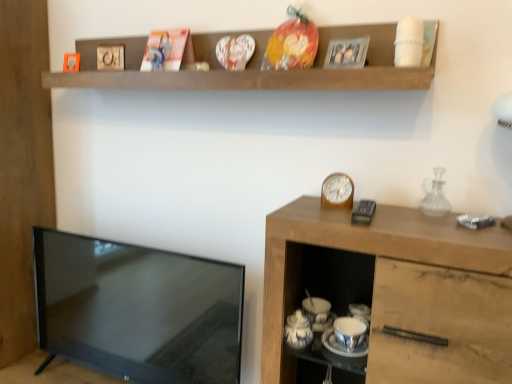
Question: Is matte cardboard picture frame at upper center, which appears as the second picture frame when viewed from the front, completely or partially outside of matte black tv at left?

Choices:
 (A) yes
 (B) no

Answer: (A)

Question: Does matte cardboard picture frame at upper center, the 2th picture frame when ordered from right to left, have a lesser width compared to matte black tv at left?

Choices:
 (A) yes
 (B) no

Answer: (A)

Question: Is matte cardboard picture frame at upper center, placed as the 3th picture frame when sorted from left to right, further to camera compared to matte black tv at left?

Choices:
 (A) yes
 (B) no

Answer: (A)

Question: Is matte cardboard picture frame at upper center, the 2th picture frame when ordered from right to left, wider than matte black tv at left?

Choices:
 (A) yes
 (B) no

Answer: (B)

Question: From a real-world perspective, is matte cardboard picture frame at upper center, which is the 3th picture frame from back to front, located beneath matte black tv at left?

Choices:
 (A) yes
 (B) no

Answer: (B)

Question: Can you confirm if matte cardboard picture frame at upper center, placed as the 3th picture frame when sorted from left to right, is smaller than matte black tv at left?

Choices:
 (A) no
 (B) yes

Answer: (B)

Question: Is matte wooden picture frame at upper left, placed as the 1th picture frame when sorted from back to front, closer to the viewer compared to matte black tv at left?

Choices:
 (A) yes
 (B) no

Answer: (B)

Question: From the image's perspective, would you say matte wooden picture frame at upper left, the first picture frame from the left, is shown under matte black tv at left?

Choices:
 (A) yes
 (B) no

Answer: (B)

Question: From the image's perspective, is matte wooden picture frame at upper left, placed as the 1th picture frame when sorted from back to front, above matte black tv at left?

Choices:
 (A) no
 (B) yes

Answer: (B)

Question: Would you consider matte wooden picture frame at upper left, placed as the 1th picture frame when sorted from back to front, to be distant from matte black tv at left?

Choices:
 (A) no
 (B) yes

Answer: (B)

Question: Is matte wooden picture frame at upper left, which appears as the 4th picture frame when viewed from the front, facing away from matte black tv at left?

Choices:
 (A) yes
 (B) no

Answer: (B)

Question: Is matte black tv at left completely or partially inside matte wooden picture frame at upper left, positioned as the 4th picture frame in right-to-left order?

Choices:
 (A) yes
 (B) no

Answer: (B)

Question: Is metallic silver photo frame at upper center, positioned as the fourth picture frame in back-to-front order, far away from metallic gold picture frame at upper center, placed as the 2th picture frame when sorted from back to front?

Choices:
 (A) no
 (B) yes

Answer: (A)